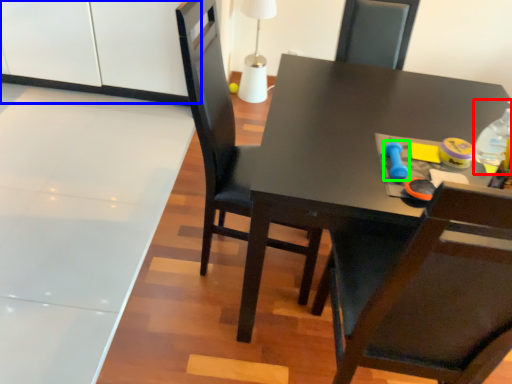
Question: Estimate the real-world distances between objects in this image. Which object is closer to bottle (highlighted by a red box), cabinetry (highlighted by a blue box) or toy (highlighted by a green box)?

Choices:
 (A) cabinetry
 (B) toy

Answer: (B)